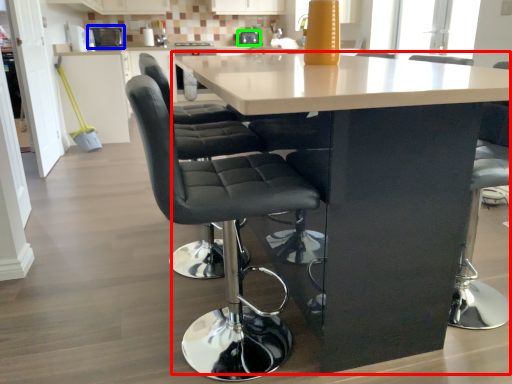
Question: Which object is positioned farthest from table (highlighted by a red box)? Select from appliance (highlighted by a blue box) and appliance (highlighted by a green box).

Choices:
 (A) appliance
 (B) appliance

Answer: (A)